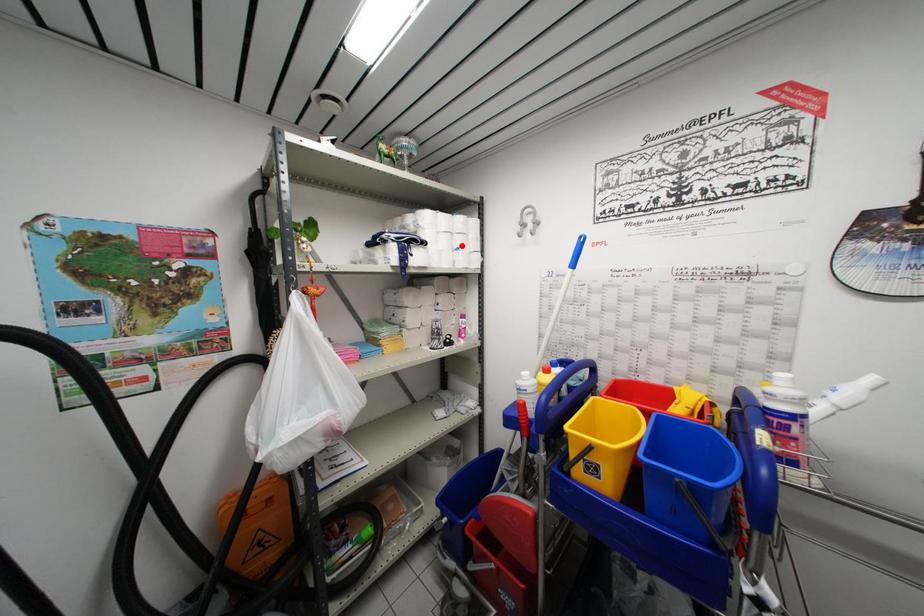
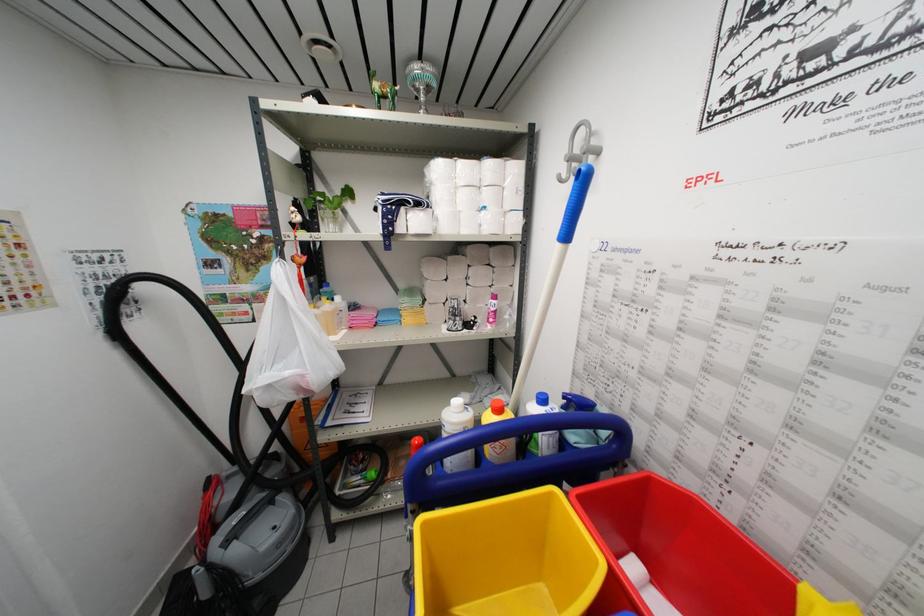
Question: I am providing you with two images of the same scene from different viewpoints. A red point is marked on the first image. At the location where the point appears in image 1, is it still visible in image 2?

Choices:
 (A) Yes
 (B) No

Answer: (A)